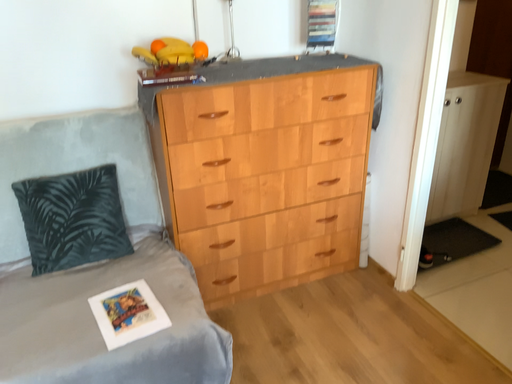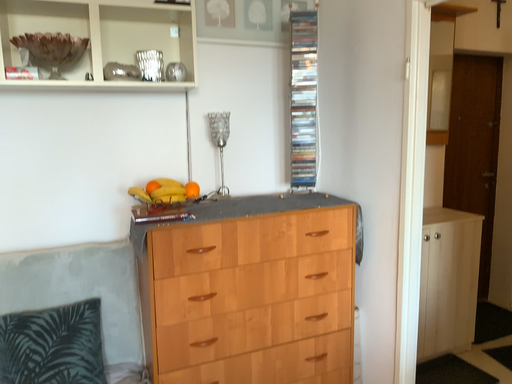
Question: Which way did the camera rotate in the video?

Choices:
 (A) rotated downward
 (B) rotated upward

Answer: (B)